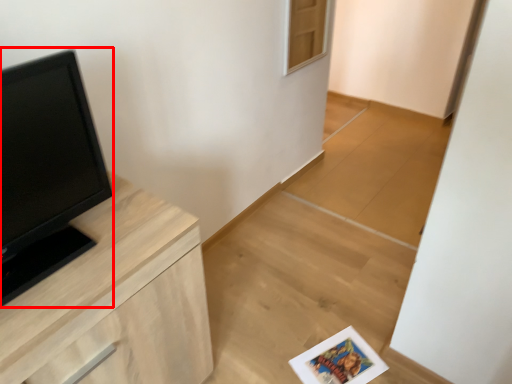
Question: Where is open (annotated by the red box) located in relation to chest of drawers in the image?

Choices:
 (A) left
 (B) right

Answer: (A)